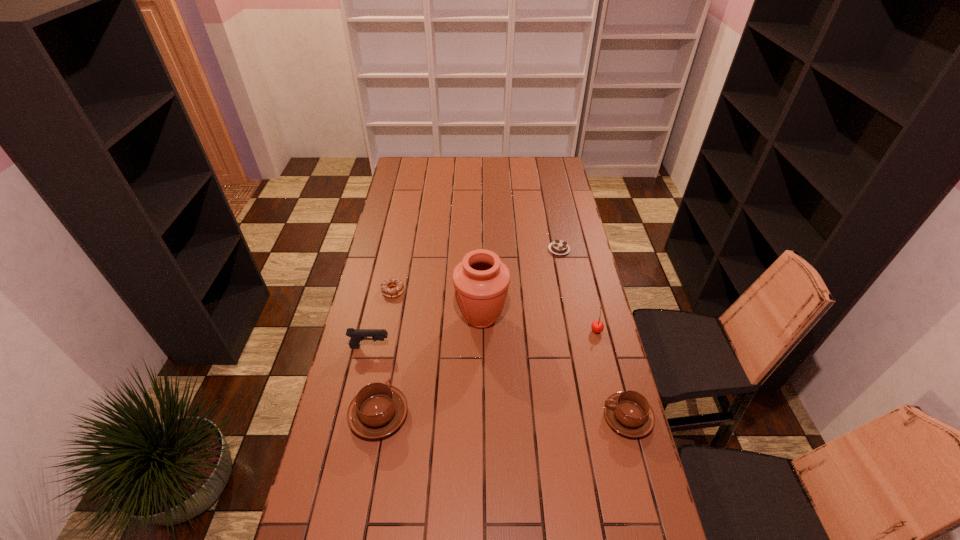
Locate an element on the screen. location for an additional cappuccino to make spacing equal is located at coordinates [503, 416].